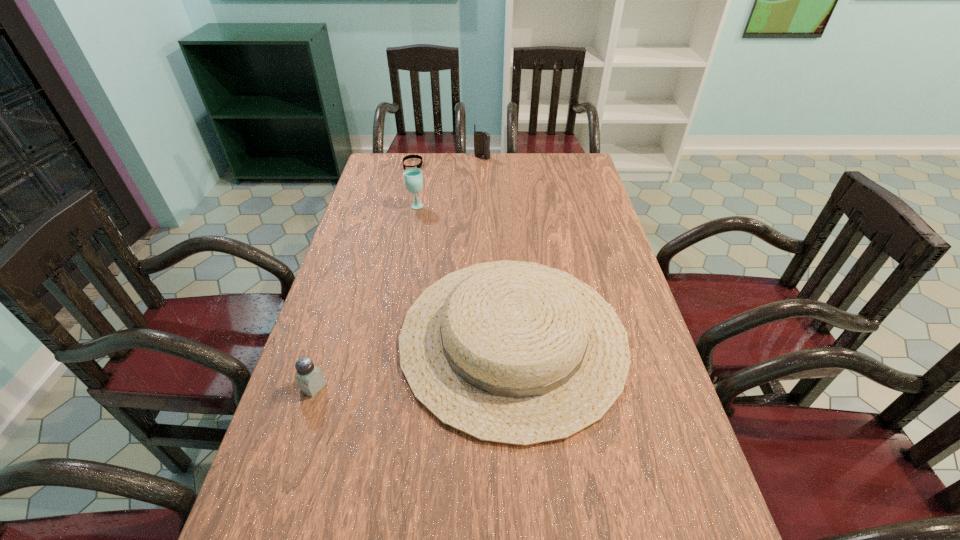
Choose which object is the nearest neighbor to the third farthest object. Please provide its 2D coordinates. Your answer should be formatted as a tuple, i.e. [(x, y)], where the tuple contains the x and y coordinates of a point satisfying the conditions above.

[(419, 165)]

Image resolution: width=960 pixels, height=540 pixels. Find the location of `object identified as the closest to the third nearest object`. object identified as the closest to the third nearest object is located at coordinates (419, 165).

Identify the location of vacant space that satisfies the following two spatial constraints: 1. on the front side of the third tallest object; 2. on the left side of the glass. (392, 339).

Locate an element on the screen. The height and width of the screenshot is (540, 960). free location that satisfies the following two spatial constraints: 1. on the display of the glass; 2. on the right side of the wristband is located at coordinates (404, 205).

You are a GUI agent. You are given a task and a screenshot of the screen. Output one action in this format:
    pyautogui.click(x=<x>, y=<y>)
    Task: Click on the free point that satisfies the following two spatial constraints: 1. on the back side of the saltshaker; 2. on the right side of the glass
    The image size is (960, 540).
    Given the screenshot: What is the action you would take?
    pyautogui.click(x=372, y=205)

At what (x,y) coordinates should I click in order to perform the action: click on vacant area that satisfies the following two spatial constraints: 1. on the display of the shortest object; 2. on the right side of the third tallest object. Please return your answer as a coordinate pair (x, y). Looking at the image, I should click on (373, 339).

The image size is (960, 540). I want to click on free space that satisfies the following two spatial constraints: 1. on the display of the third shortest object; 2. on the right side of the shortest object, so click(373, 339).